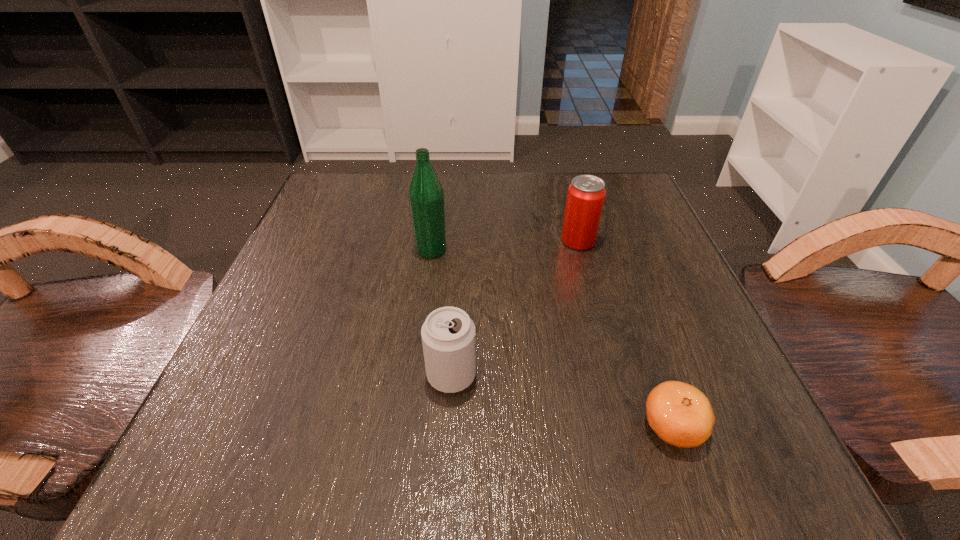
I want to click on vacant region between the nearer can and the clementine, so click(563, 401).

This screenshot has width=960, height=540. I want to click on the second closest object relative to the third farthest object, so click(426, 197).

This screenshot has height=540, width=960. I want to click on object that is the third closest one to the right can, so click(x=681, y=415).

This screenshot has width=960, height=540. Find the location of `free point that satisfies the following two spatial constraints: 1. on the front side of the clementine; 2. on the left side of the farther can`. free point that satisfies the following two spatial constraints: 1. on the front side of the clementine; 2. on the left side of the farther can is located at coordinates (629, 427).

Image resolution: width=960 pixels, height=540 pixels. What are the coordinates of `blank space that satisfies the following two spatial constraints: 1. on the front side of the left can; 2. on the right side of the clementine` in the screenshot? It's located at (448, 427).